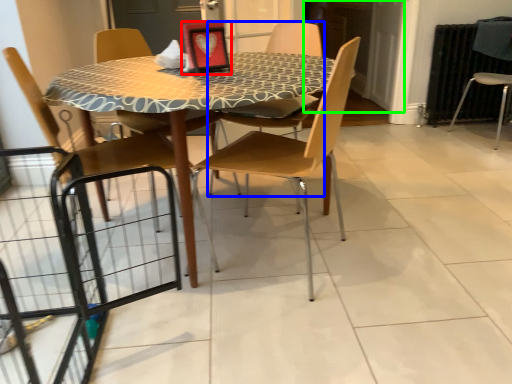
Question: Which object is the farthest from picture frame (highlighted by a red box)? Choose among these: chair (highlighted by a blue box) or screen door (highlighted by a green box).

Choices:
 (A) chair
 (B) screen door

Answer: (B)